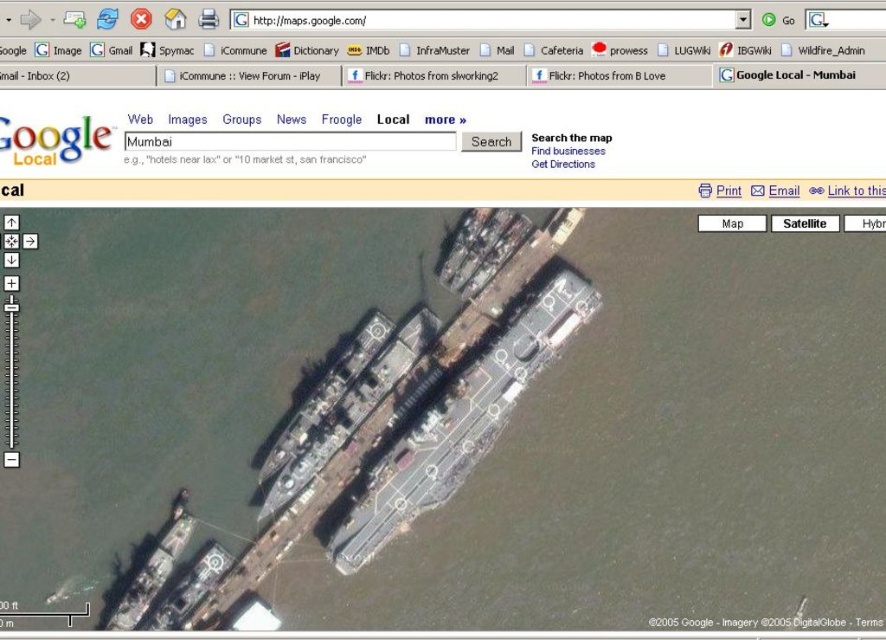
Does point (566, 317) lie behind point (199, 564)?

No, (566, 317) is closer to viewer.

Is dark gray metallic aircraft carrier at center above metallic gray boat at lower left?

Indeed, dark gray metallic aircraft carrier at center is positioned over metallic gray boat at lower left.

This screenshot has width=886, height=640. Identify the location of dark gray metallic aircraft carrier at center. [x=460, y=422].

Between gray water at center and dark gray metallic boat at lower left, which one appears on the right side from the viewer's perspective?

gray water at center

Which is in front, point (498, 544) or point (149, 595)?

Point (498, 544)

Based on the photo, who is more forward, (744, 298) or (159, 588)?

Point (159, 588) is more forward.

Identify the location of gray water at center. [662, 451].

Does gray water at center appear over metallic gray boat at lower left?

Yes.

How distant is gray water at center from metallic gray boat at lower left?

A distance of 23.55 meters exists between gray water at center and metallic gray boat at lower left.

Which is in front, point (704, 266) or point (176, 628)?

Positioned in front is point (176, 628).

In order to click on gray water at center in this screenshot , I will do `click(662, 451)`.